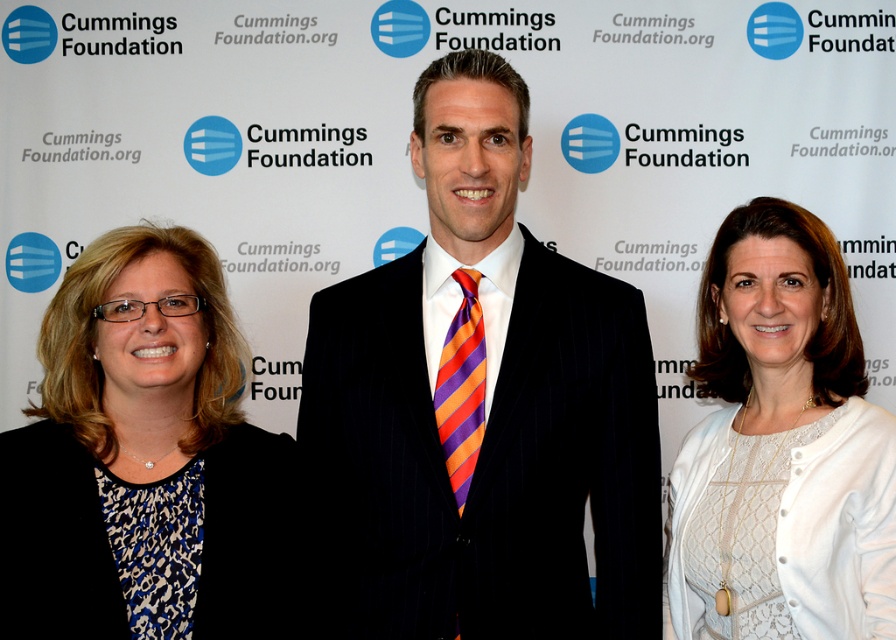
Is blue printed blouse at left bigger than orange and purple striped tie at center?

Indeed, blue printed blouse at left has a larger size compared to orange and purple striped tie at center.

The width and height of the screenshot is (896, 640). I want to click on blue printed blouse at left, so click(x=147, y=458).

Where is `blue printed blouse at left`? The width and height of the screenshot is (896, 640). blue printed blouse at left is located at coordinates (147, 458).

Can you confirm if velvet black suit at center is positioned to the left of white lace dress at center?

Indeed, velvet black suit at center is positioned on the left side of white lace dress at center.

Looking at this image, who is positioned more to the right, velvet black suit at center or white lace dress at center?

white lace dress at center is more to the right.

Which is in front, point (332, 440) or point (816, 448)?

Point (816, 448) is in front.

The image size is (896, 640). I want to click on velvet black suit at center, so click(481, 406).

Does velvet black suit at center have a greater height compared to orange and purple striped tie at center?

Correct, velvet black suit at center is much taller as orange and purple striped tie at center.

Is velvet black suit at center below orange and purple striped tie at center?

No.

Describe the element at coordinates (481, 406) in the screenshot. I see `velvet black suit at center` at that location.

Locate an element on the screen. velvet black suit at center is located at coordinates (481, 406).